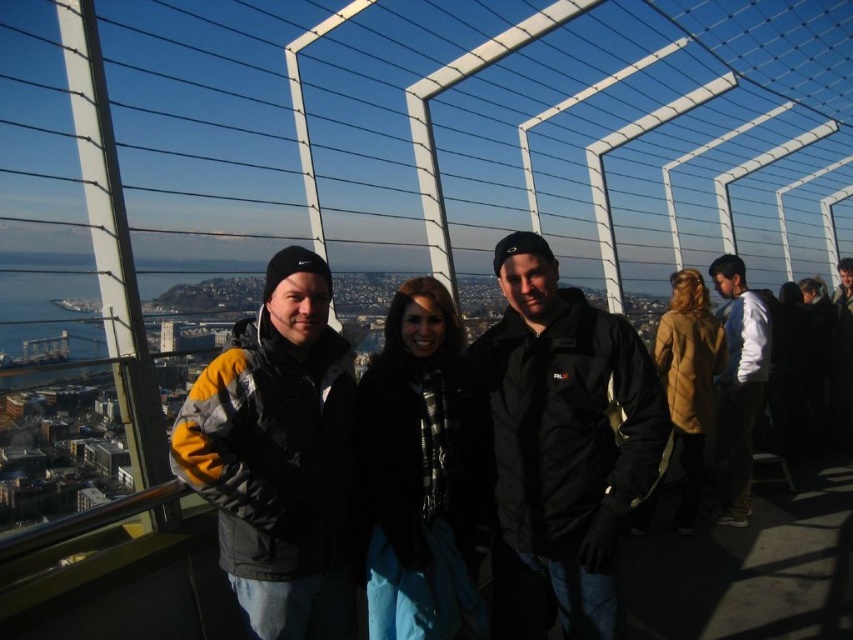
Which is below, yellow-gray jacket at center-left or white shirt at right?

Positioned lower is yellow-gray jacket at center-left.

Can you confirm if yellow-gray jacket at center-left is smaller than white shirt at right?

Incorrect, yellow-gray jacket at center-left is not smaller in size than white shirt at right.

The height and width of the screenshot is (640, 853). I want to click on yellow-gray jacket at center-left, so click(277, 456).

At what (x,y) coordinates should I click in order to perform the action: click on yellow-gray jacket at center-left. Please return your answer as a coordinate pair (x, y). The image size is (853, 640). Looking at the image, I should click on (277, 456).

Who is taller, black matte jacket at center or white shirt at right?

black matte jacket at center is taller.

Is black matte jacket at center smaller than white shirt at right?

Incorrect, black matte jacket at center is not smaller in size than white shirt at right.

Locate an element on the screen. The height and width of the screenshot is (640, 853). black matte jacket at center is located at coordinates (561, 444).

Does black matte jacket at center have a lesser height compared to yellow-gray jacket at center-left?

Incorrect, black matte jacket at center's height does not fall short of yellow-gray jacket at center-left's.

Who is more forward, (561, 595) or (332, 600)?

Point (561, 595) is more forward.

You are a GUI agent. You are given a task and a screenshot of the screen. Output one action in this format:
    pyautogui.click(x=<x>, y=<y>)
    Task: Click on the black matte jacket at center
    
    Given the screenshot: What is the action you would take?
    pyautogui.click(x=561, y=444)